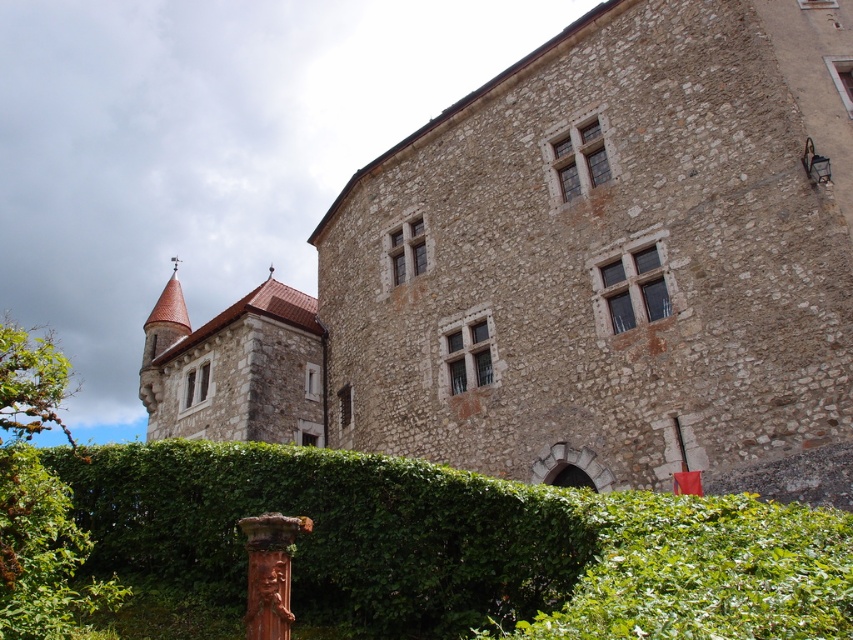
Describe the element at coordinates (581, 269) in the screenshot. This screenshot has width=853, height=640. I see `brown stone castle at center` at that location.

Looking at this image, is brown stone castle at center shorter than green leafy hedge at lower center?

In fact, brown stone castle at center may be taller than green leafy hedge at lower center.

Consider the image. Who is more forward, (440,269) or (410,540)?

Point (410,540)

Identify the location of brown stone castle at center. Image resolution: width=853 pixels, height=640 pixels. (581, 269).